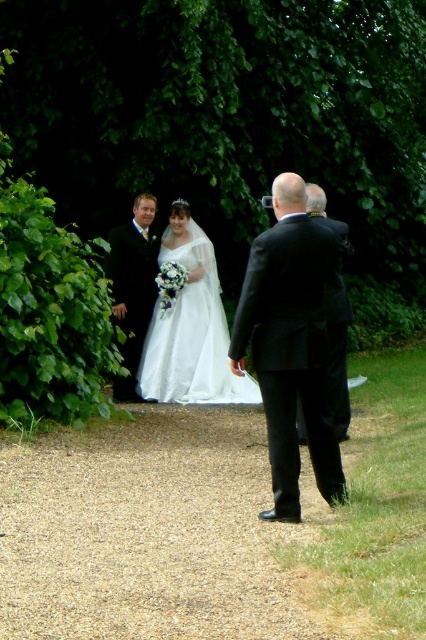
You are a photographer setting up for a wedding photo. You need to position a backdrop behind the white lace dress at center and the black satin suit at right. If the backdrop is 1.5 meters wide, will it be wide enough to cover both subjects?

The white lace dress at center might be wider than black satin suit at right, so the total width required could exceed 1.5 meters. The backdrop may not be wide enough to cover both subjects fully.

You are a photographer at a wedding and need to position the subjects so that their outfits are clearly visible. Given the white lace dress at center and the black satin suit at right, which outfit requires more space to capture in the photo?

The black satin suit at right requires more space because it is larger than the white lace dress at center.

You are planning to walk down the gravel path at center to reach the white lace dress at center. Considering the size difference between them, which one will you encounter first?

The gravel path at center has a smaller size compared to white lace dress at center, so you will encounter the gravel path at center first because it is closer to your starting point.